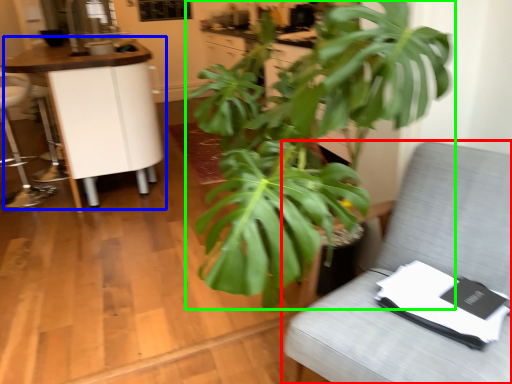
Question: Which object is the closest to the furniture (highlighted by a red box)? Choose among these: table (highlighted by a blue box) or houseplant (highlighted by a green box).

Choices:
 (A) table
 (B) houseplant

Answer: (B)